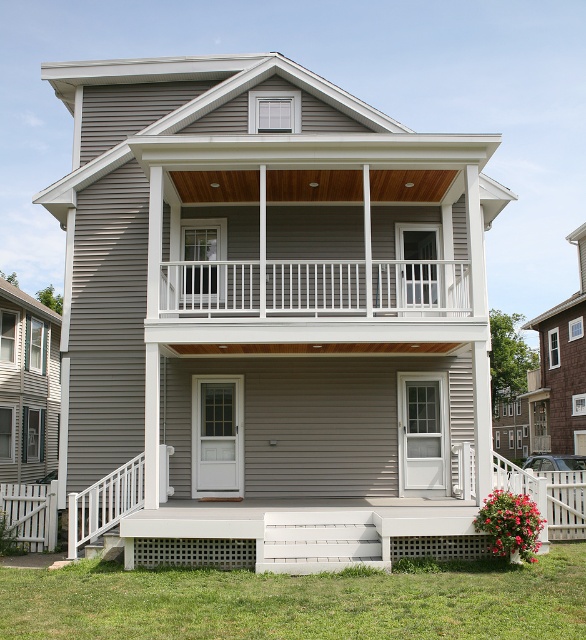
Can you confirm if white wooden railing at upper center is thinner than white plastic balustrade at lower left?

No.

Which of these two, white wooden railing at upper center or white plastic balustrade at lower left, stands shorter?

white wooden railing at upper center

Who is more distant from viewer, (x=452, y=314) or (x=104, y=506)?

The point (x=452, y=314) is behind.

At what (x,y) coordinates should I click in order to perform the action: click on white wooden railing at upper center. Please return your answer as a coordinate pair (x, y). The image size is (586, 640). Looking at the image, I should click on (366, 288).